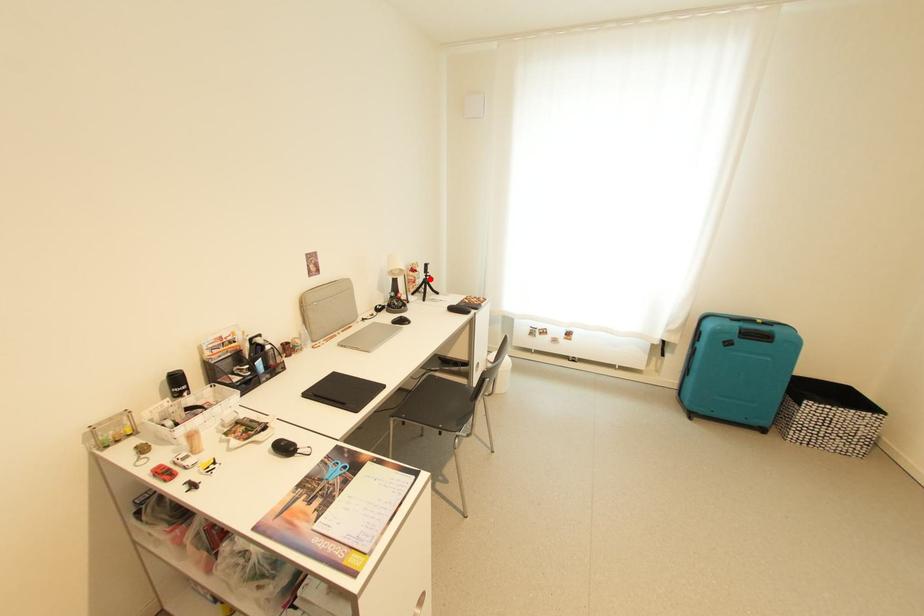
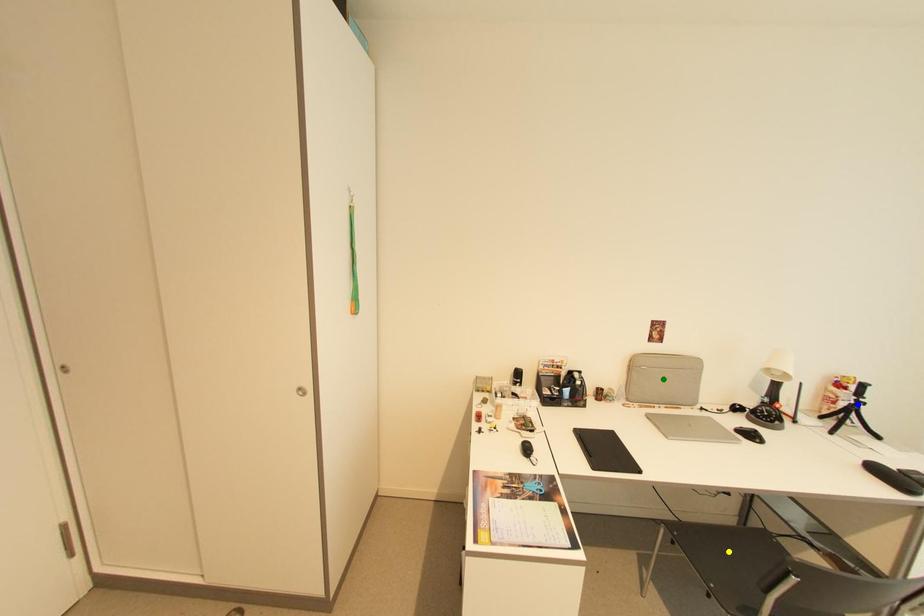
Question: I am providing you with two images of the same scene from different viewpoints. A red point is marked on the first image. You are given multiple points on the second image. Which point in image 2 represents the same 3d spot as the red point in image 1?

Choices:
 (A) green point
 (B) yellow point
 (C) blue point

Answer: (C)